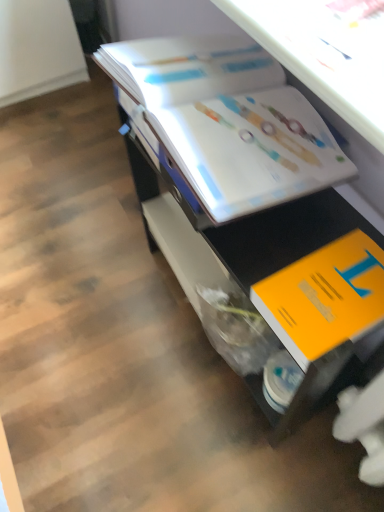
Question: Is white glossy book at upper center smaller than white glossy book at upper center, which ranks as the first book in top-to-bottom order?

Choices:
 (A) yes
 (B) no

Answer: (B)

Question: Does white glossy book at upper center lie behind white glossy book at upper center, which ranks as the first book in top-to-bottom order?

Choices:
 (A) yes
 (B) no

Answer: (B)

Question: Considering the relative sizes of white glossy book at upper center and white glossy book at upper center, the second book ordered from the bottom, in the image provided, is white glossy book at upper center thinner than white glossy book at upper center, the second book ordered from the bottom,?

Choices:
 (A) no
 (B) yes

Answer: (A)

Question: From a real-world perspective, does white glossy book at upper center sit lower than white glossy book at upper center, which ranks as the first book in top-to-bottom order?

Choices:
 (A) no
 (B) yes

Answer: (B)

Question: Is white glossy book at upper center turned away from white glossy book at upper center, which ranks as the first book in top-to-bottom order?

Choices:
 (A) yes
 (B) no

Answer: (B)

Question: From the image's perspective, would you say white glossy book at upper center is positioned over white glossy book at upper center, which ranks as the first book in top-to-bottom order?

Choices:
 (A) yes
 (B) no

Answer: (B)

Question: From a real-world perspective, is orange matte book at lower right, positioned as the first book in bottom-to-top order, under white glossy book at upper center, the second book ordered from the bottom?

Choices:
 (A) no
 (B) yes

Answer: (B)

Question: Is orange matte book at lower right, which appears as the second book when viewed from the top, thinner than white glossy book at upper center, which ranks as the first book in top-to-bottom order?

Choices:
 (A) no
 (B) yes

Answer: (B)

Question: Is orange matte book at lower right, positioned as the first book in bottom-to-top order, outside of white glossy book at upper center, which ranks as the first book in top-to-bottom order?

Choices:
 (A) no
 (B) yes

Answer: (B)

Question: Can you confirm if orange matte book at lower right, which appears as the second book when viewed from the top, is shorter than white glossy book at upper center, the second book ordered from the bottom?

Choices:
 (A) yes
 (B) no

Answer: (A)

Question: Considering the relative positions of orange matte book at lower right, which appears as the second book when viewed from the top, and white glossy book at upper center, the second book ordered from the bottom, in the image provided, is orange matte book at lower right, which appears as the second book when viewed from the top, to the right of white glossy book at upper center, the second book ordered from the bottom, from the viewer's perspective?

Choices:
 (A) yes
 (B) no

Answer: (A)

Question: Is orange matte book at lower right, which appears as the second book when viewed from the top, looking in the opposite direction of white glossy book at upper center, the second book ordered from the bottom?

Choices:
 (A) no
 (B) yes

Answer: (A)

Question: Considering the relative positions of white glossy book at upper center, which ranks as the first book in top-to-bottom order, and orange matte book at lower right, positioned as the first book in bottom-to-top order, in the image provided, is white glossy book at upper center, which ranks as the first book in top-to-bottom order, to the right of orange matte book at lower right, positioned as the first book in bottom-to-top order, from the viewer's perspective?

Choices:
 (A) yes
 (B) no

Answer: (B)